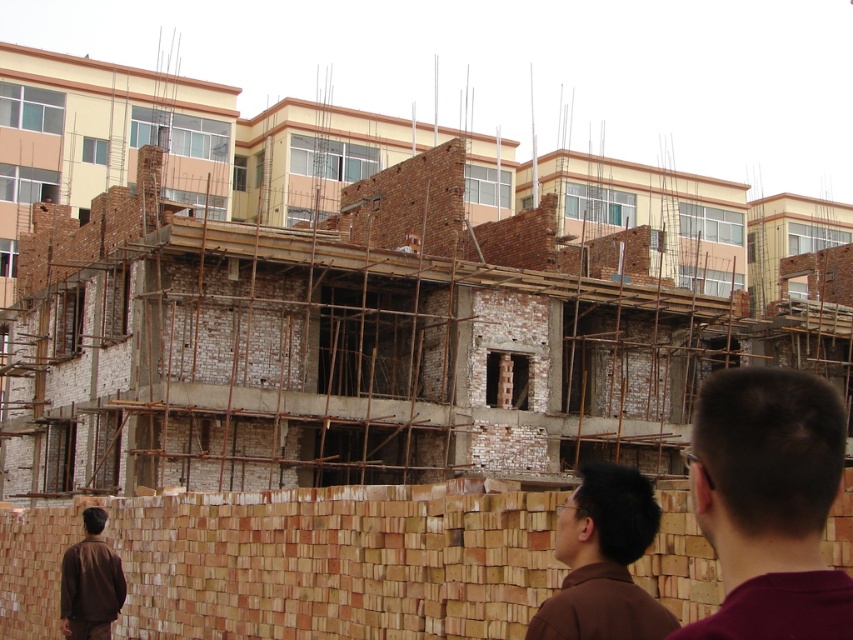
Question: Which is nearer to the brown brick wall at lower center?

Choices:
 (A) brown matte shirt at lower left
 (B) brown hair at upper right

Answer: (A)

Question: Among these points, which one is farthest from the camera?

Choices:
 (A) (613, 532)
 (B) (758, 616)

Answer: (A)

Question: Which object appears closest to the camera in this image?

Choices:
 (A) brown hair at upper right
 (B) brown brick wall at lower center
 (C) brown matte shirt at lower left
 (D) brown matte shirt at lower right

Answer: (A)

Question: Is brown hair at upper right thinner than brown matte shirt at lower left?

Choices:
 (A) no
 (B) yes

Answer: (A)

Question: Does brown brick wall at lower center appear under brown matte shirt at lower left?

Choices:
 (A) yes
 (B) no

Answer: (B)

Question: Is brown hair at upper right smaller than brown matte shirt at lower right?

Choices:
 (A) yes
 (B) no

Answer: (A)